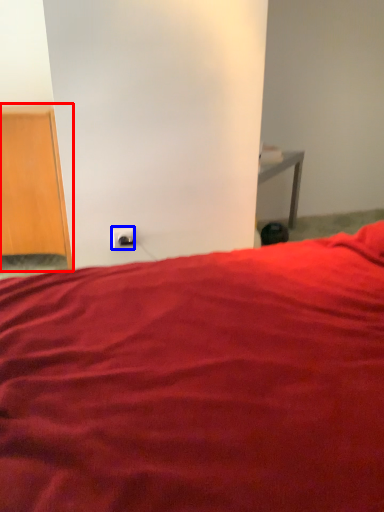
Question: Which object appears farthest to the camera in this image, furniture (highlighted by a red box) or electric outlet (highlighted by a blue box)?

Choices:
 (A) furniture
 (B) electric outlet

Answer: (B)